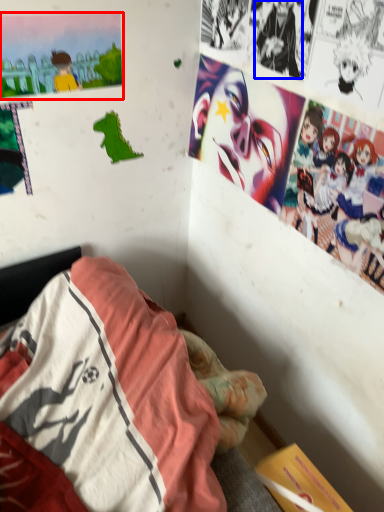
Question: Which point is further to the camera, poster page (highlighted by a red box) or person (highlighted by a blue box)?

Choices:
 (A) poster page
 (B) person

Answer: (A)